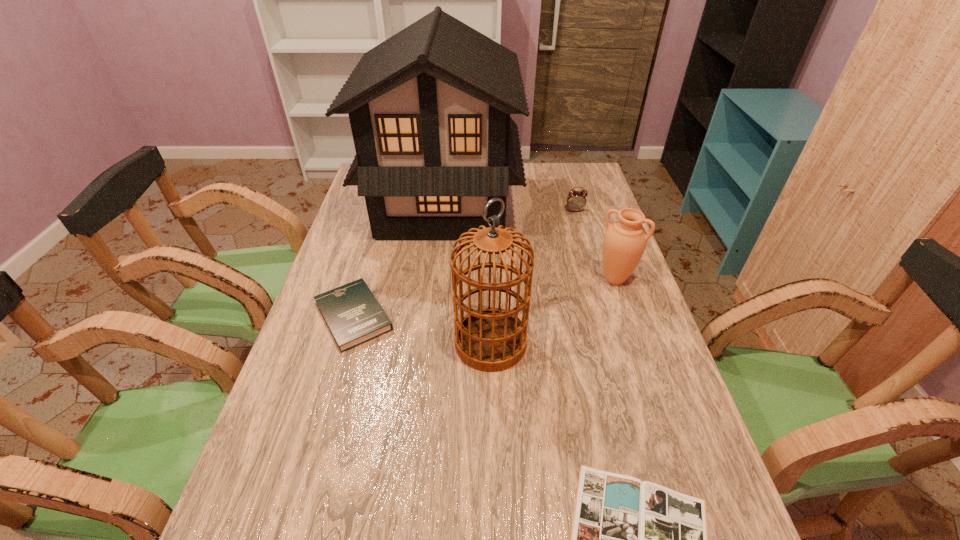
At what (x,y) coordinates should I click in order to perform the action: click on vacant space that satisfies the following two spatial constraints: 1. on the face of the third tallest object; 2. on the right side of the alarm clock. Please return your answer as a coordinate pair (x, y). This screenshot has height=540, width=960. Looking at the image, I should click on (594, 279).